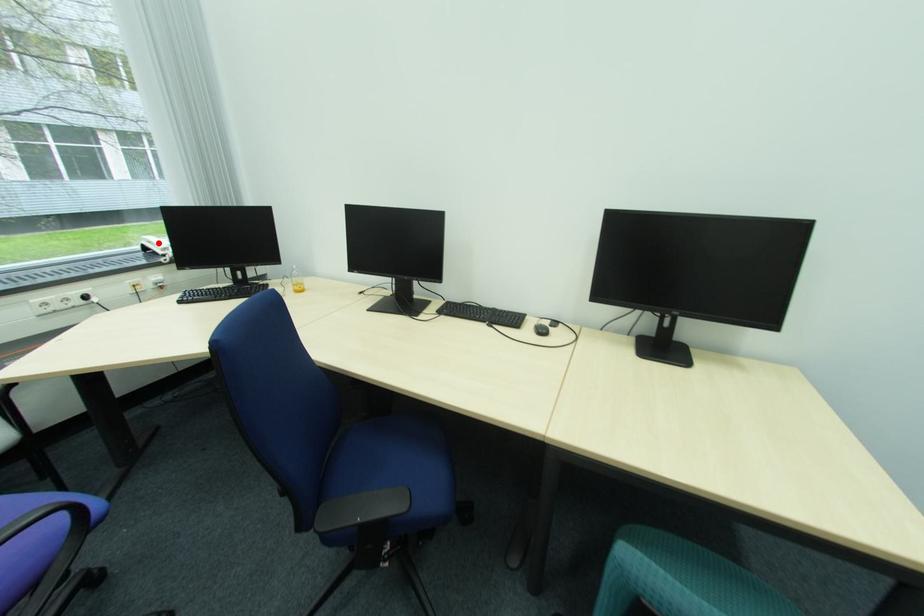
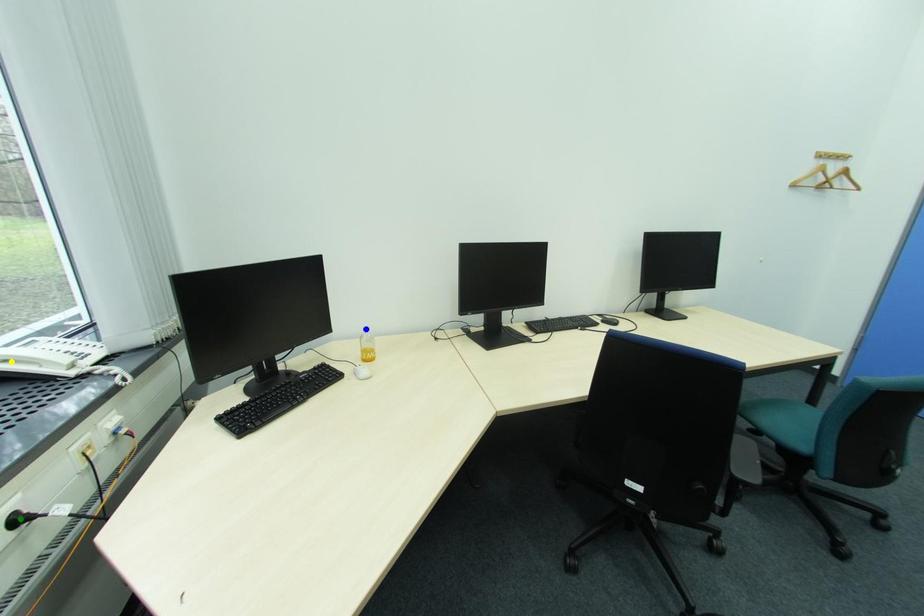
Question: I am providing you with two images of the same scene from different viewpoints. A red point is marked on the first image. You are given multiple points on the second image. Which point in image 2 is actually the same real-world point as the red point in image 1?

Choices:
 (A) blue point
 (B) green point
 (C) yellow point

Answer: (C)